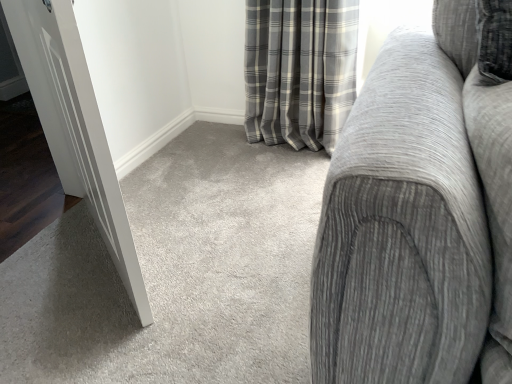
Measure the distance between point [345,172] and camera.

Point [345,172] is 22.13 inches from camera.

Describe the element at coordinates (419, 216) in the screenshot. I see `gray fabric couch at right` at that location.

The height and width of the screenshot is (384, 512). Identify the location of gray fabric couch at right. (419, 216).

What do you see at coordinates (75, 126) in the screenshot? I see `white glossy door at left` at bounding box center [75, 126].

Where is `white glossy door at left`? This screenshot has height=384, width=512. white glossy door at left is located at coordinates (75, 126).

The width and height of the screenshot is (512, 384). Identify the location of gray fabric couch at right. (419, 216).

Considering the relative positions of gray fabric couch at right and white glossy door at left in the image provided, is gray fabric couch at right to the left or to the right of white glossy door at left?

In the image, gray fabric couch at right appears on the right side of white glossy door at left.

Is gray fabric couch at right closer to the viewer compared to white glossy door at left?

Yes, the depth of gray fabric couch at right is less than that of white glossy door at left.

Which is behind, point (447, 150) or point (23, 21)?

The point (23, 21) is behind.

From the image's perspective, does gray fabric couch at right appear higher than white glossy door at left?

Correct, gray fabric couch at right appears higher than white glossy door at left in the image.

From a real-world perspective, relative to white glossy door at left, is gray fabric couch at right vertically above or below?

In terms of real-world spatial position, gray fabric couch at right is above white glossy door at left.

In terms of width, does gray fabric couch at right look wider or thinner when compared to white glossy door at left?

Clearly, gray fabric couch at right has more width compared to white glossy door at left.

Considering the relative sizes of gray fabric couch at right and white glossy door at left in the image provided, is gray fabric couch at right taller than white glossy door at left?

In fact, gray fabric couch at right may be shorter than white glossy door at left.

Does gray fabric couch at right have a smaller size compared to white glossy door at left?

Incorrect, gray fabric couch at right is not smaller in size than white glossy door at left.

Is gray fabric couch at right completely or partially outside of white glossy door at left?

Yes.

Would you say gray fabric couch at right is a long distance from white glossy door at left?

No, gray fabric couch at right is in close proximity to white glossy door at left.

Is gray fabric couch at right aimed at white glossy door at left?

No, gray fabric couch at right is not oriented towards white glossy door at left.

What's the angular difference between gray fabric couch at right and white glossy door at left's facing directions?

They differ by 75.7 degrees in their facing directions.

How distant is gray fabric couch at right from white glossy door at left?

The distance of gray fabric couch at right from white glossy door at left is 33.27 inches.

At what (x,y) coordinates should I click in order to perform the action: click on door located on the left of gray fabric couch at right. Please return your answer as a coordinate pair (x, y). This screenshot has width=512, height=384. Looking at the image, I should click on (75, 126).

Does white glossy door at left appear on the right side of gray fabric couch at right?

Incorrect, white glossy door at left is not on the right side of gray fabric couch at right.

Is white glossy door at left positioned in front of gray fabric couch at right?

No, white glossy door at left is behind gray fabric couch at right.

Is point (87, 66) less distant than point (480, 308)?

No, (87, 66) is behind (480, 308).

From the image's perspective, is white glossy door at left under gray fabric couch at right?

Correct, white glossy door at left appears lower than gray fabric couch at right in the image.

From a real-world perspective, between white glossy door at left and gray fabric couch at right, who is vertically lower?

From a 3D spatial view, white glossy door at left is below.

In the scene shown: Considering the sizes of white glossy door at left and gray fabric couch at right in the image, is white glossy door at left wider or thinner than gray fabric couch at right?

Considering their sizes, white glossy door at left looks slimmer than gray fabric couch at right.

Is white glossy door at left taller than gray fabric couch at right?

Yes.

Considering the relative sizes of white glossy door at left and gray fabric couch at right in the image provided, is white glossy door at left bigger than gray fabric couch at right?

Actually, white glossy door at left might be smaller than gray fabric couch at right.

From the picture: Can we say white glossy door at left lies outside gray fabric couch at right?

white glossy door at left is positioned outside gray fabric couch at right.

Would you say white glossy door at left is a long distance from gray fabric couch at right?

white glossy door at left is near gray fabric couch at right, not far away.

Does white glossy door at left turn towards gray fabric couch at right?

No, white glossy door at left is not oriented towards gray fabric couch at right.

This screenshot has height=384, width=512. In order to click on door lying behind the gray fabric couch at right in this screenshot , I will do `click(75, 126)`.

Identify the location of studio couch above the white glossy door at left (from a real-world perspective). (419, 216).

You are a GUI agent. You are given a task and a screenshot of the screen. Output one action in this format:
    pyautogui.click(x=<x>, y=<y>)
    Task: Click on the door on the left side of gray fabric couch at right
    The width and height of the screenshot is (512, 384).
    Given the screenshot: What is the action you would take?
    pyautogui.click(x=75, y=126)